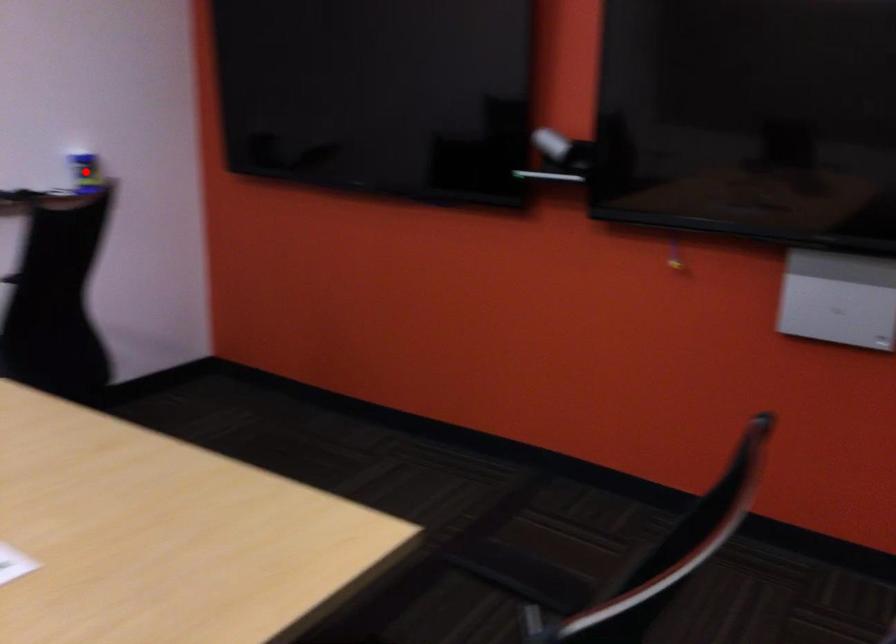
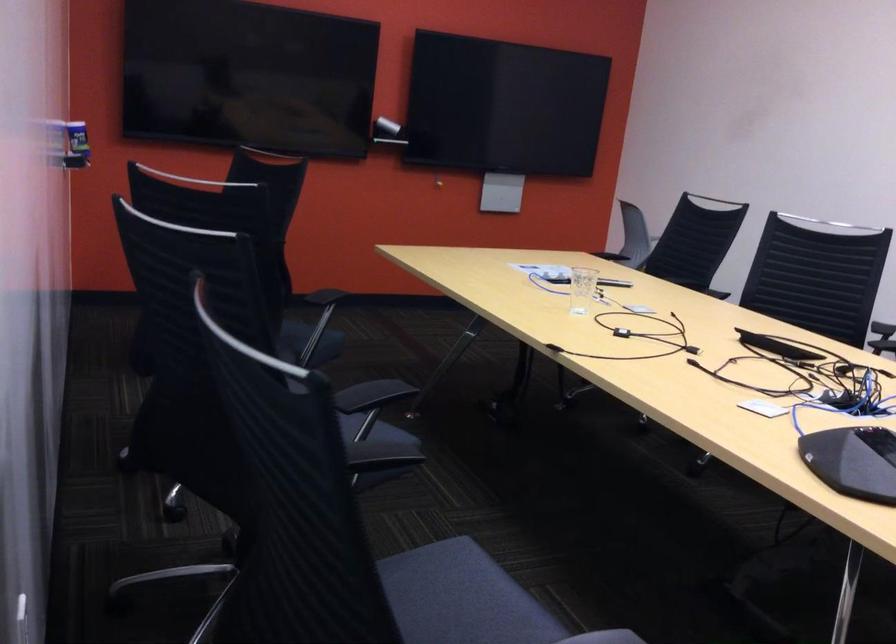
Question: I am providing you with two images of the same scene from different viewpoints. A red point is marked on the first image. Can you still see the location of the red point in image 2?

Choices:
 (A) Yes
 (B) No

Answer: (B)